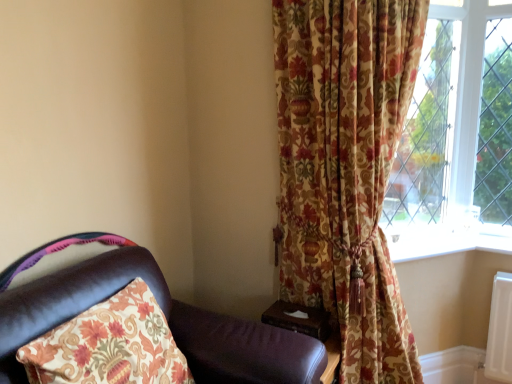
Question: From the image's perspective, would you say white plastic window sill at lower right is shown under leather chair at left?

Choices:
 (A) yes
 (B) no

Answer: (B)

Question: Is white plastic window sill at lower right oriented away from leather chair at left?

Choices:
 (A) yes
 (B) no

Answer: (B)

Question: Is white plastic window sill at lower right taller than leather chair at left?

Choices:
 (A) no
 (B) yes

Answer: (A)

Question: Is white plastic window sill at lower right to the left of leather chair at left from the viewer's perspective?

Choices:
 (A) yes
 (B) no

Answer: (B)

Question: Considering the relative sizes of white plastic window sill at lower right and leather chair at left in the image provided, is white plastic window sill at lower right thinner than leather chair at left?

Choices:
 (A) yes
 (B) no

Answer: (A)

Question: Considering the positions of white plastic window sill at lower right and wooden at right in the image, is white plastic window sill at lower right bigger or smaller than wooden at right?

Choices:
 (A) big
 (B) small

Answer: (A)

Question: Is point (391, 256) positioned closer to the camera than point (287, 314)?

Choices:
 (A) closer
 (B) farther

Answer: (B)

Question: In the image, is white plastic window sill at lower right on the left side or the right side of wooden at right?

Choices:
 (A) left
 (B) right

Answer: (B)

Question: In terms of width, does white plastic window sill at lower right look wider or thinner when compared to wooden at right?

Choices:
 (A) wide
 (B) thin

Answer: (B)

Question: Is white plastic window sill at lower right inside the boundaries of leather chair at left, or outside?

Choices:
 (A) inside
 (B) outside

Answer: (B)

Question: From their relative heights in the image, would you say white plastic window sill at lower right is taller or shorter than leather chair at left?

Choices:
 (A) short
 (B) tall

Answer: (A)

Question: Considering the positions of point [x=423, y=235] and point [x=179, y=324], is point [x=423, y=235] closer or farther from the camera than point [x=179, y=324]?

Choices:
 (A) farther
 (B) closer

Answer: (A)

Question: Looking at the image, does white plastic window sill at lower right seem bigger or smaller compared to leather chair at left?

Choices:
 (A) big
 (B) small

Answer: (B)

Question: Is wooden at right situated inside leather chair at left or outside?

Choices:
 (A) outside
 (B) inside

Answer: (A)

Question: Is wooden at right bigger or smaller than leather chair at left?

Choices:
 (A) big
 (B) small

Answer: (B)